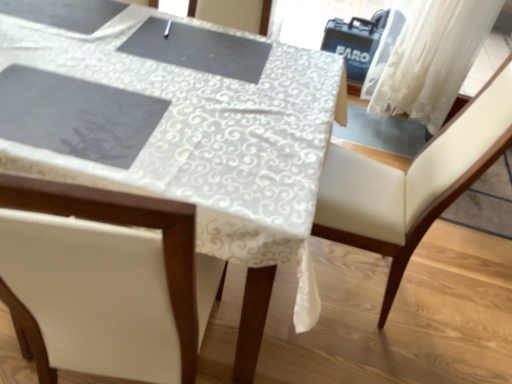
Question: Is white leather chair at center to the left of white lace tablecloth at center from the viewer's perspective?

Choices:
 (A) no
 (B) yes

Answer: (A)

Question: Is there a large distance between white leather chair at center and white lace tablecloth at center?

Choices:
 (A) yes
 (B) no

Answer: (B)

Question: Considering the relative sizes of white leather chair at center and white lace tablecloth at center in the image provided, is white leather chair at center thinner than white lace tablecloth at center?

Choices:
 (A) no
 (B) yes

Answer: (B)

Question: From a real-world perspective, is white leather chair at center on top of white lace tablecloth at center?

Choices:
 (A) no
 (B) yes

Answer: (B)

Question: Can you confirm if white leather chair at center is positioned to the right of white lace tablecloth at center?

Choices:
 (A) yes
 (B) no

Answer: (A)

Question: In terms of height, does white lace tablecloth at center look taller or shorter compared to white sheer curtain at upper right?

Choices:
 (A) tall
 (B) short

Answer: (B)

Question: Based on their positions, is white lace tablecloth at center located to the left or right of white sheer curtain at upper right?

Choices:
 (A) left
 (B) right

Answer: (A)

Question: Considering their positions, is white lace tablecloth at center located in front of or behind white sheer curtain at upper right?

Choices:
 (A) behind
 (B) front

Answer: (B)

Question: Considering the positions of point (166, 291) and point (424, 11), is point (166, 291) closer or farther from the camera than point (424, 11)?

Choices:
 (A) closer
 (B) farther

Answer: (A)

Question: In terms of height, does white leather chair at center look taller or shorter compared to white lace tablecloth at center?

Choices:
 (A) tall
 (B) short

Answer: (A)

Question: From the image's perspective, is white leather chair at center positioned above or below white lace tablecloth at center?

Choices:
 (A) above
 (B) below

Answer: (B)

Question: Considering the positions of white leather chair at center and white lace tablecloth at center in the image, is white leather chair at center wider or thinner than white lace tablecloth at center?

Choices:
 (A) thin
 (B) wide

Answer: (A)

Question: In the image, is white leather chair at center positioned in front of or behind white lace tablecloth at center?

Choices:
 (A) front
 (B) behind

Answer: (B)

Question: From the image's perspective, is white sheer curtain at upper right above or below white leather chair at center?

Choices:
 (A) below
 (B) above

Answer: (B)

Question: Considering the positions of white sheer curtain at upper right and white leather chair at center in the image, is white sheer curtain at upper right wider or thinner than white leather chair at center?

Choices:
 (A) thin
 (B) wide

Answer: (A)